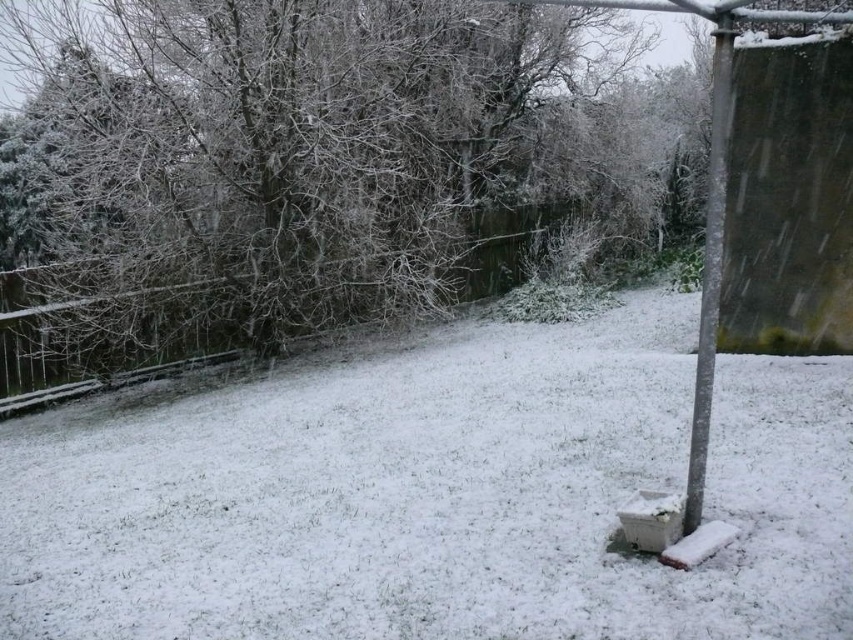
Question: Observing the image, what is the correct spatial positioning of snow-covered branches at upper left in reference to metallic pole at right?

Choices:
 (A) left
 (B) right

Answer: (A)

Question: Which of the following is the closest to the observer?

Choices:
 (A) wooden at left
 (B) metallic pole at right
 (C) snow-covered branches at upper left

Answer: (B)

Question: Which point is closer to the camera?

Choices:
 (A) (711, 8)
 (B) (418, 180)

Answer: (A)

Question: Which object is farther from the camera taking this photo?

Choices:
 (A) snow-covered branches at upper left
 (B) metallic pole at right
 (C) wooden at left

Answer: (C)

Question: Does snow-covered branches at upper left have a smaller size compared to wooden at left?

Choices:
 (A) yes
 (B) no

Answer: (B)

Question: Is snow-covered branches at upper left positioned before metallic pole at right?

Choices:
 (A) no
 (B) yes

Answer: (A)